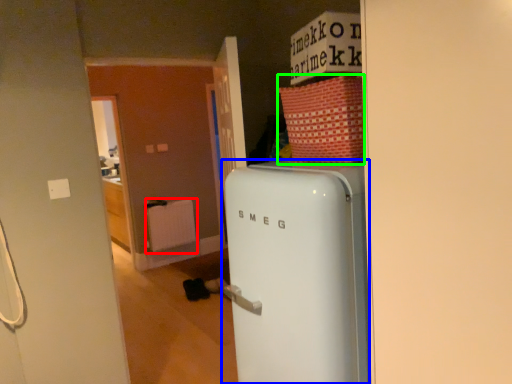
Question: Considering the real-world distances, which object is farthest from radiator (highlighted by a red box)? refrigerator (highlighted by a blue box) or cardboard box (highlighted by a green box)?

Choices:
 (A) refrigerator
 (B) cardboard box

Answer: (B)